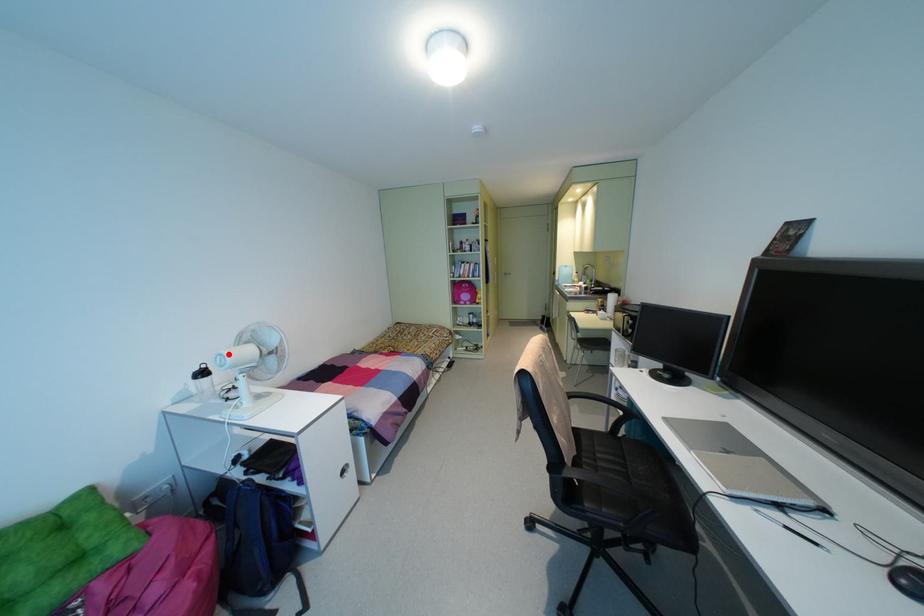
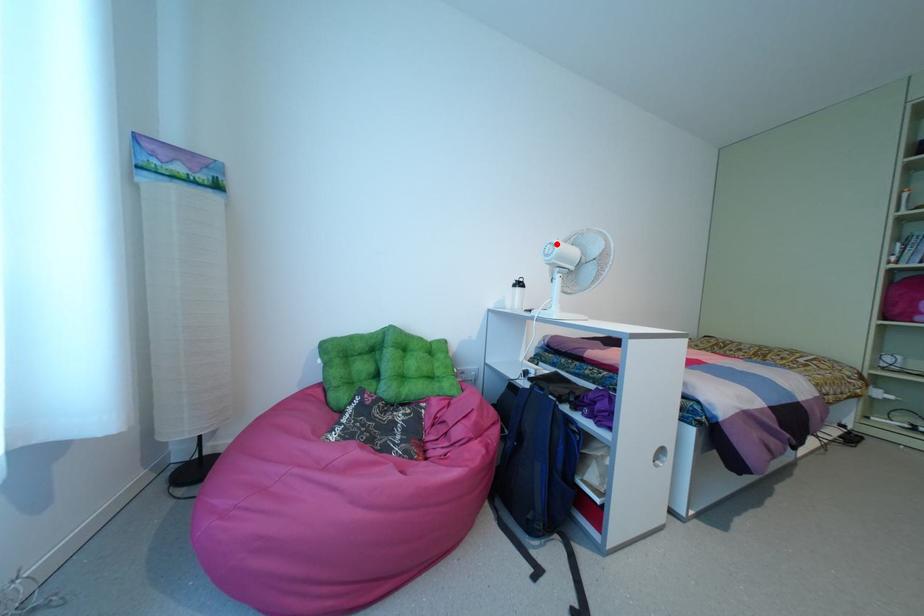
I am providing you with two images of the same scene from different viewpoints. A red point is marked on the first image and another point is marked on the second image. Is the red point in image1 aligned with the point shown in image2?

Yes